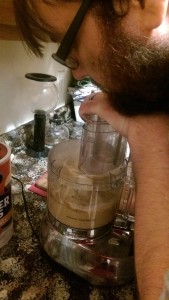
In order to click on silver base of appliance in this screenshot , I will do `click(121, 259)`, `click(110, 278)`, `click(67, 258)`, `click(49, 235)`.